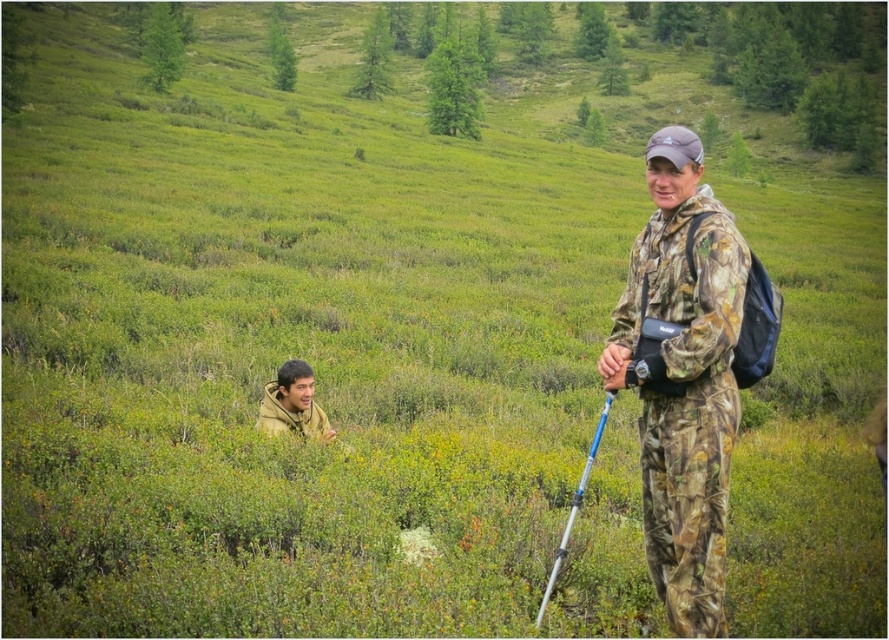
This screenshot has height=640, width=889. I want to click on camouflage jacket at lower left, so click(292, 403).

Describe the element at coordinates (292, 403) in the screenshot. I see `camouflage jacket at lower left` at that location.

Is point (275, 385) closer to viewer compared to point (566, 525)?

No, (275, 385) is further to viewer.

This screenshot has height=640, width=889. In order to click on camouflage jacket at lower left in this screenshot , I will do `click(292, 403)`.

How much distance is there between camo-patterned jacket at center and silver metallic ski pole at center?

A distance of 9.93 feet exists between camo-patterned jacket at center and silver metallic ski pole at center.

Does camo-patterned jacket at center have a greater width compared to silver metallic ski pole at center?

Indeed, camo-patterned jacket at center has a greater width compared to silver metallic ski pole at center.

Where is `camo-patterned jacket at center`? camo-patterned jacket at center is located at coordinates (683, 378).

In order to click on camo-patterned jacket at center in this screenshot , I will do `click(683, 378)`.

Can you confirm if camo-patterned jacket at center is positioned above camouflage jacket at lower left?

Indeed, camo-patterned jacket at center is positioned over camouflage jacket at lower left.

Which is more to the left, camo-patterned jacket at center or camouflage jacket at lower left?

camouflage jacket at lower left is more to the left.

What do you see at coordinates (683, 378) in the screenshot?
I see `camo-patterned jacket at center` at bounding box center [683, 378].

Identify the location of camo-patterned jacket at center. The height and width of the screenshot is (640, 889). (683, 378).